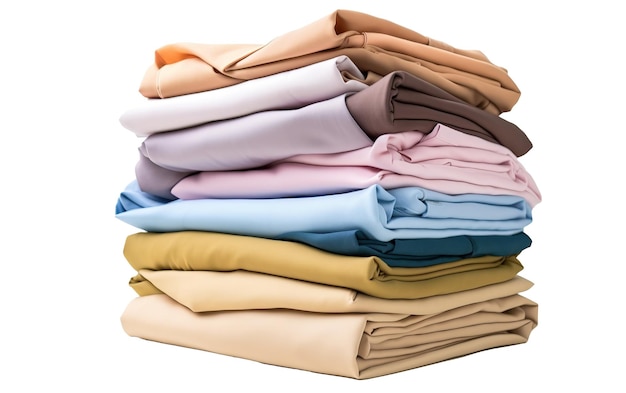
This screenshot has height=393, width=626. I want to click on laundry, so click(273, 345), click(250, 303), click(248, 261), click(356, 243), click(307, 215), click(300, 178), click(280, 131), click(280, 88), click(289, 57).